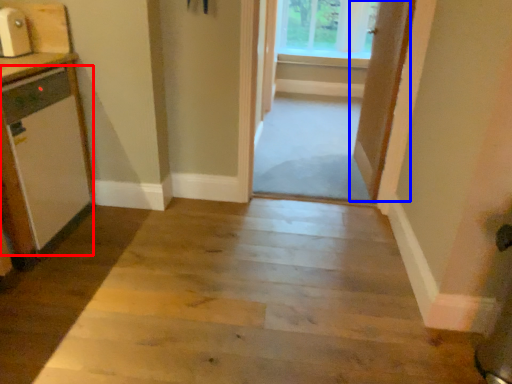
Question: Which point is further to the camera, appliance (highlighted by a red box) or door (highlighted by a blue box)?

Choices:
 (A) appliance
 (B) door

Answer: (B)